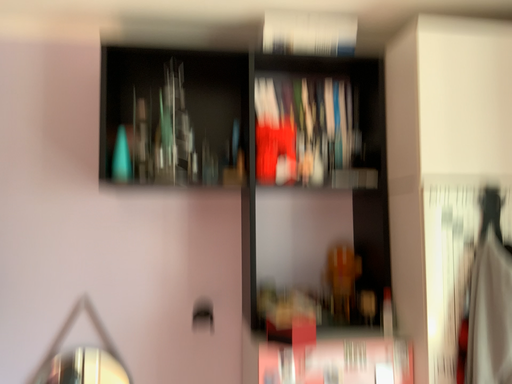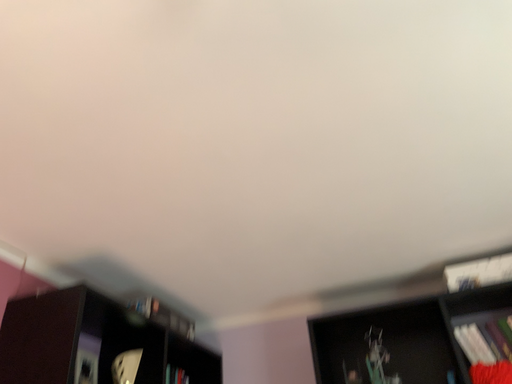
Question: How did the camera likely rotate when shooting the video?

Choices:
 (A) rotated right
 (B) rotated left

Answer: (B)